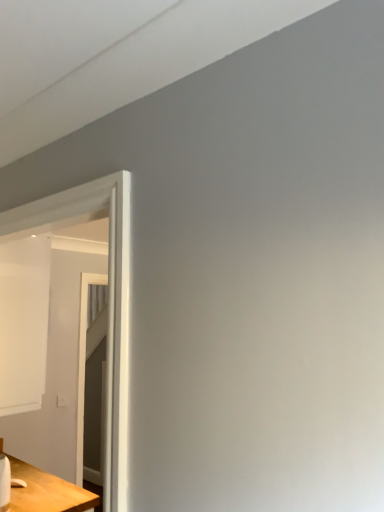
What is the approximate height of white glossy door at left?

It is 36.72 inches.

Where is `white glossy door at left`? white glossy door at left is located at coordinates (110, 301).

What is the approximate width of white glossy door at left?

The width of white glossy door at left is 4.81 inches.

What do you see at coordinates (110, 301) in the screenshot?
I see `white glossy door at left` at bounding box center [110, 301].

What do you see at coordinates (47, 490) in the screenshot?
I see `wooden table at lower left` at bounding box center [47, 490].

The width and height of the screenshot is (384, 512). Identify the location of wooden table at lower left. (47, 490).

What is the approximate width of wooden table at lower left?

The width of wooden table at lower left is 48.34 centimeters.

Find the location of a particular element. This screenshot has width=384, height=512. white glossy door at left is located at coordinates (110, 301).

Based on the photo, considering the positions of objects wooden table at lower left and white glossy door at left in the image provided, who is more to the right, wooden table at lower left or white glossy door at left?

Positioned to the right is white glossy door at left.

From the picture: Who is more distant, wooden table at lower left or white glossy door at left?

wooden table at lower left is behind.

From the picture: Which point is more forward, [28,484] or [114,192]?

The point [114,192] is in front.

From the image's perspective, is wooden table at lower left beneath white glossy door at left?

Yes, from the image's perspective, wooden table at lower left is beneath white glossy door at left.

From a real-world perspective, is wooden table at lower left positioned over white glossy door at left based on gravity?

Incorrect, from a real-world perspective, wooden table at lower left is lower than white glossy door at left.

Does wooden table at lower left have a greater width compared to white glossy door at left?

Correct, the width of wooden table at lower left exceeds that of white glossy door at left.

Considering the sizes of objects wooden table at lower left and white glossy door at left in the image provided, who is shorter, wooden table at lower left or white glossy door at left?

wooden table at lower left.

Is wooden table at lower left smaller than white glossy door at left?

No, wooden table at lower left is not smaller than white glossy door at left.

Would you say wooden table at lower left contains white glossy door at left?

No.

Is wooden table at lower left next to white glossy door at left and touching it?

No, wooden table at lower left is not touching white glossy door at left.

Is white glossy door at left at the back of wooden table at lower left?

No, wooden table at lower left is not facing away from white glossy door at left.

How many degrees apart are the facing directions of wooden table at lower left and white glossy door at left?

180 degrees.

How distant is wooden table at lower left from white glossy door at left?

1.36 meters.

The image size is (384, 512). Identify the location of glass door that is above the wooden table at lower left (from the image's perspective). (110, 301).

Based on their positions, is white glossy door at left located to the left or right of wooden table at lower left?

In the image, white glossy door at left appears on the right side of wooden table at lower left.

Which is in front, white glossy door at left or wooden table at lower left?

Positioned in front is white glossy door at left.

Which is farther from the camera, (78,413) or (37,503)?

The point (78,413) is farther from the camera.

From the image's perspective, which one is positioned lower, white glossy door at left or wooden table at lower left?

wooden table at lower left appears lower in the image.

From a real-world perspective, is white glossy door at left over wooden table at lower left?

Yes, from a real-world perspective, white glossy door at left is over wooden table at lower left

Is white glossy door at left wider or thinner than wooden table at lower left?

white glossy door at left is thinner than wooden table at lower left.

Between white glossy door at left and wooden table at lower left, which one has more height?

With more height is white glossy door at left.

Who is smaller, white glossy door at left or wooden table at lower left?

With smaller size is white glossy door at left.

Is white glossy door at left positioned beyond the bounds of wooden table at lower left?

white glossy door at left is positioned outside wooden table at lower left.

Are white glossy door at left and wooden table at lower left making contact?

No, white glossy door at left is not beside wooden table at lower left.

Is white glossy door at left oriented away from wooden table at lower left?

white glossy door at left is not turned away from wooden table at lower left.

Measure the distance from white glossy door at left to wooden table at lower left.

white glossy door at left and wooden table at lower left are 4.48 feet apart from each other.

This screenshot has height=512, width=384. Find the location of `table lying on the left of white glossy door at left`. table lying on the left of white glossy door at left is located at coordinates (47, 490).

Where is `glass door on the right of wooden table at lower left`? The height and width of the screenshot is (512, 384). glass door on the right of wooden table at lower left is located at coordinates point(110,301).

Identify the location of glass door above the wooden table at lower left (from a real-world perspective). The width and height of the screenshot is (384, 512). (110, 301).